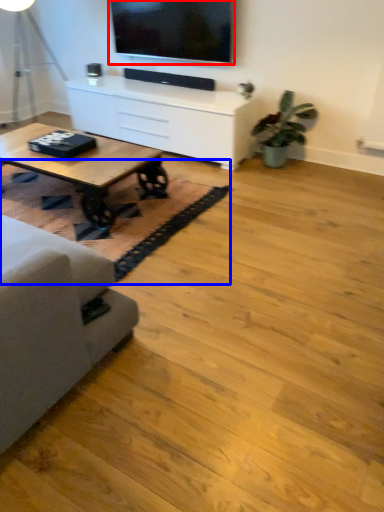
Question: Which point is further to the camera, television (highlighted by a red box) or mat (highlighted by a blue box)?

Choices:
 (A) television
 (B) mat

Answer: (A)